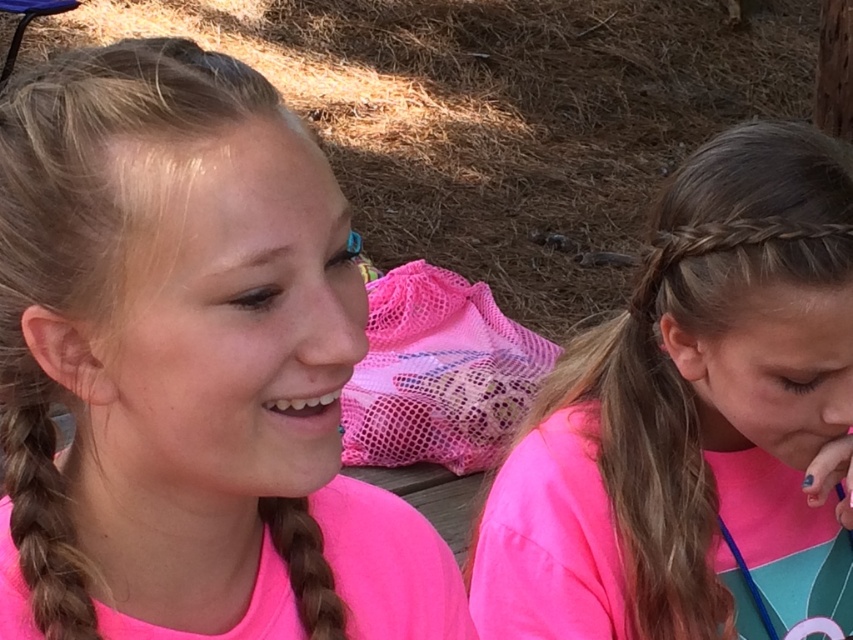
You are organizing a clothing display and need to place the pink matte shirt at left and the pink fabric shirt at right on a shelf. Which shirt should you place first if you want to arrange them from smallest to largest based on their size?

The pink matte shirt at left should be placed first because it occupies less space than the pink fabric shirt at right, making it the smaller of the two.

You are designing a layout for a magazine spread that needs to highlight both the pink matte shirt at left and the brown silky hair at center. Considering their sizes, which object should be placed in a larger space to maintain visual balance?

The pink matte shirt at left is larger in size than the brown silky hair at center, so to maintain visual balance, the pink matte shirt at left should be placed in a larger space.

You are a photographer standing in front of the two girls. You want to take a photo of the pink matte shirt at left and the brown silky hair at center. Which object should you focus on first to ensure both are in sharp focus?

The pink matte shirt at left is closer to the viewer than the brown silky hair at center. To ensure both are in sharp focus, you should focus on the brown silky hair at center because it is further away, allowing the depth of field to cover both objects.